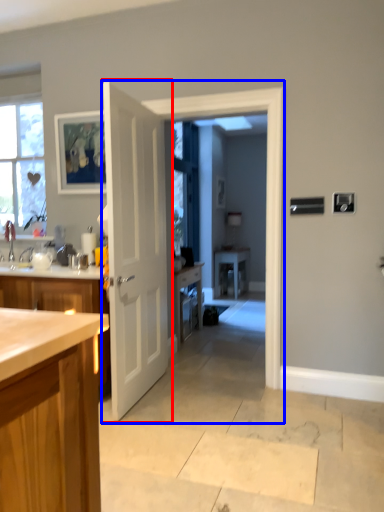
Question: Which of the following is the farthest to the observer, door (highlighted by a red box) or screen door (highlighted by a blue box)?

Choices:
 (A) door
 (B) screen door

Answer: (B)